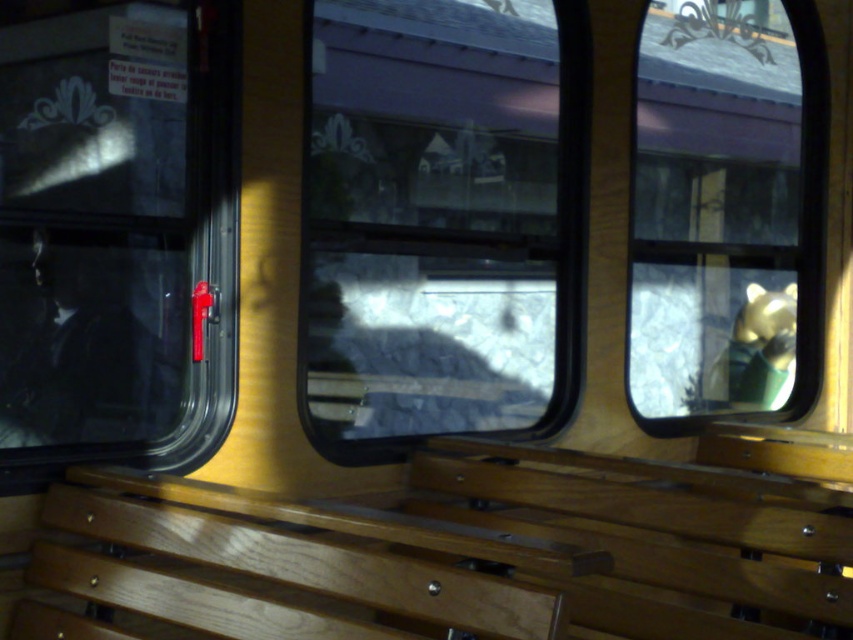
Question: Can you confirm if wooden bench at center is positioned to the right of transparent glass window at left?

Choices:
 (A) yes
 (B) no

Answer: (A)

Question: Can you confirm if wooden bench at center is thinner than transparent glass window at center?

Choices:
 (A) yes
 (B) no

Answer: (B)

Question: Considering the real-world distances, which object is closest to the wooden bench at center?

Choices:
 (A) transparent glass window at center
 (B) transparent glass window at left
 (C) gold metallic bear at upper right

Answer: (A)

Question: Does wooden bench at center lie behind transparent glass window at center?

Choices:
 (A) no
 (B) yes

Answer: (A)

Question: Which object is positioned farthest from the wooden bench at center?

Choices:
 (A) transparent glass window at center
 (B) gold metallic bear at upper right

Answer: (B)

Question: Which object is positioned farthest from the transparent glass window at left?

Choices:
 (A) transparent glass window at center
 (B) wooden bench at center
 (C) gold metallic bear at upper right

Answer: (C)